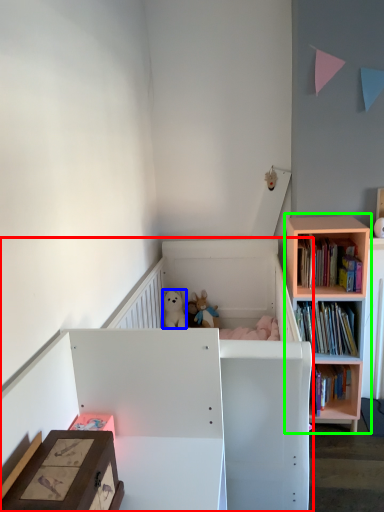
Question: Which object is positioned farthest from infant bed (highlighted by a red box)? Select from animal (highlighted by a blue box) and shelf (highlighted by a green box).

Choices:
 (A) animal
 (B) shelf

Answer: (A)